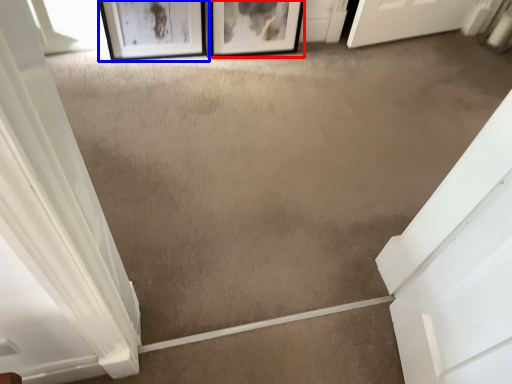
Question: Which object is closer to the camera taking this photo, picture frame (highlighted by a red box) or picture frame (highlighted by a blue box)?

Choices:
 (A) picture frame
 (B) picture frame

Answer: (B)